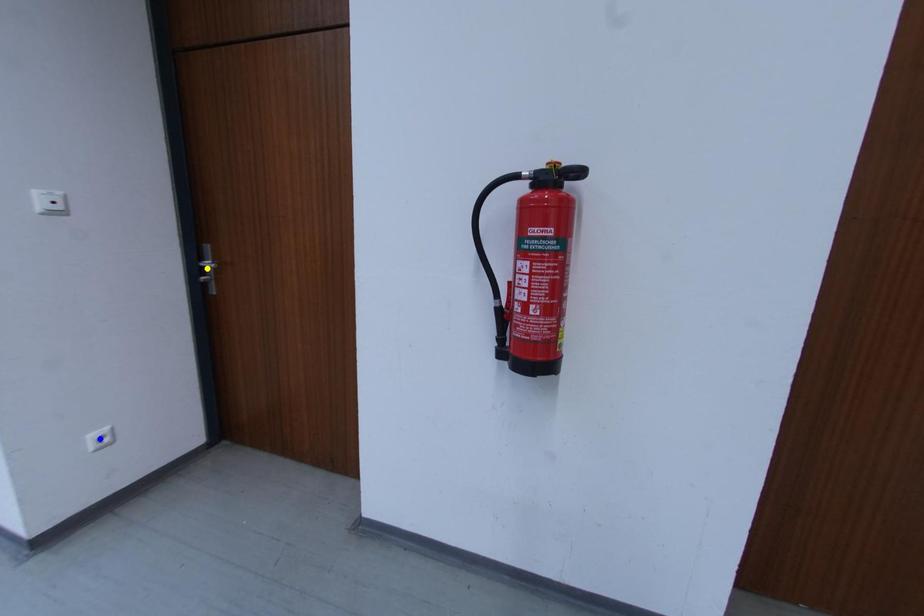
Order these from farthest to nearest:
- purple point
- blue point
- yellow point

yellow point → blue point → purple point